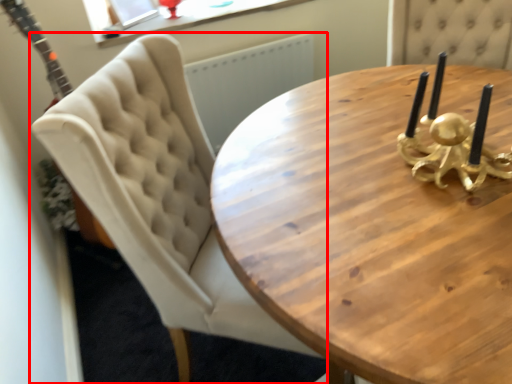
Question: From the image, what is the correct spatial relationship of chair (annotated by the red box) in relation to coffee table?

Choices:
 (A) right
 (B) left

Answer: (B)